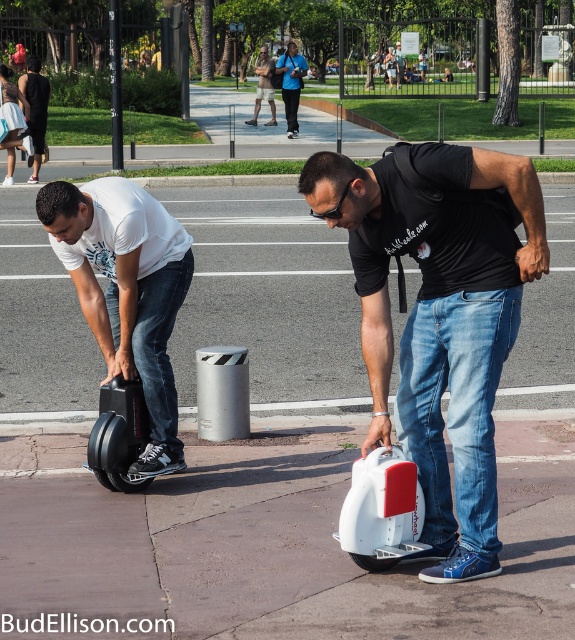
From the picture: Is smooth concrete sidewalk at center positioned in front of blue fabric jacket at center?

Yes, smooth concrete sidewalk at center is closer to the viewer.

Who is positioned more to the left, smooth concrete sidewalk at center or blue fabric jacket at center?

blue fabric jacket at center is more to the left.

Between point (301, 244) and point (293, 61), which one is positioned behind?

The point (293, 61) is behind.

Find the location of a particular element. smooth concrete sidewalk at center is located at coordinates (267, 292).

Does white plastic scooter at lower center have a larger size compared to khaki cotton shorts at center?

Incorrect, white plastic scooter at lower center is not larger than khaki cotton shorts at center.

Is point (384, 468) closer to camera compared to point (269, 83)?

Yes.

Identify the location of white plastic scooter at lower center. (381, 509).

Who is more distant from viewer, (120, 321) or (256, 84)?

Point (256, 84)

Between black matte hoverboard at left and khaki cotton shorts at center, which one has more height?

With more height is khaki cotton shorts at center.

Find the location of a particular element. This screenshot has width=575, height=640. black matte hoverboard at left is located at coordinates (126, 291).